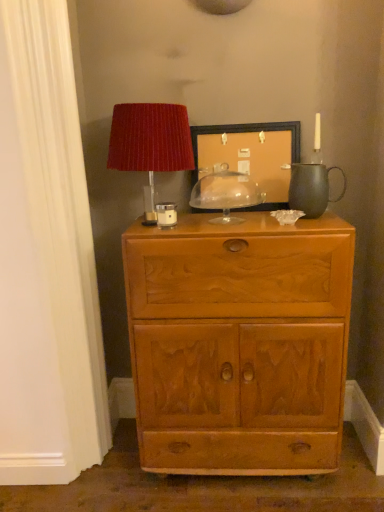
Identify the location of vacant space to the right of matte red lampshade at upper left. (233, 220).